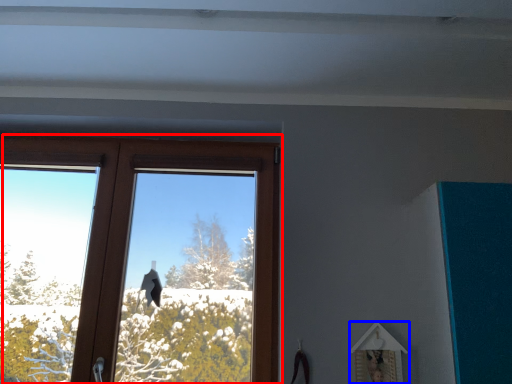
Question: Which object is further to the camera taking this photo, window (highlighted by a red box) or picture frame (highlighted by a blue box)?

Choices:
 (A) window
 (B) picture frame

Answer: (A)